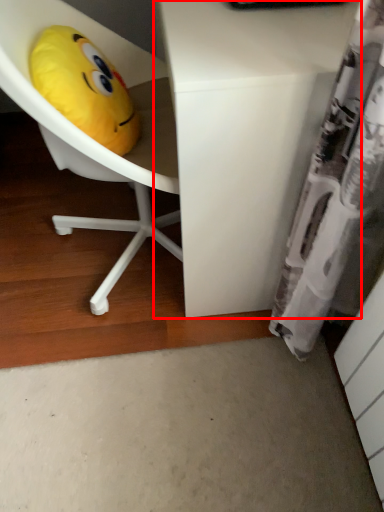
Question: Observing the image, what is the correct spatial positioning of desk (annotated by the red box) in reference to toy?

Choices:
 (A) right
 (B) left

Answer: (A)